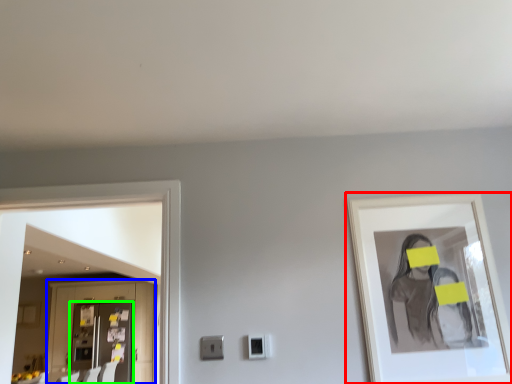
Question: Based on their relative distances, which object is farther from picture frame (highlighted by a red box)? Choose from cabinetry (highlighted by a blue box) and door (highlighted by a green box).

Choices:
 (A) cabinetry
 (B) door

Answer: (B)